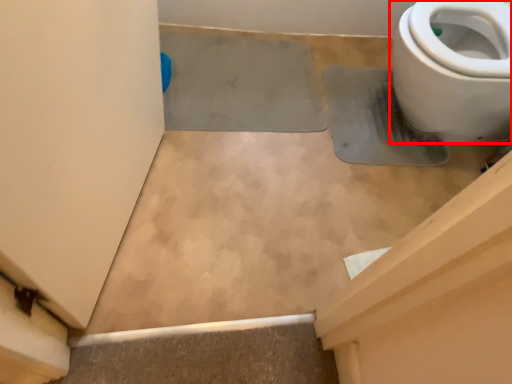
Question: From the image's perspective, what is the correct spatial positioning of toilet (annotated by the red box) in reference to concrete?

Choices:
 (A) below
 (B) above

Answer: (B)